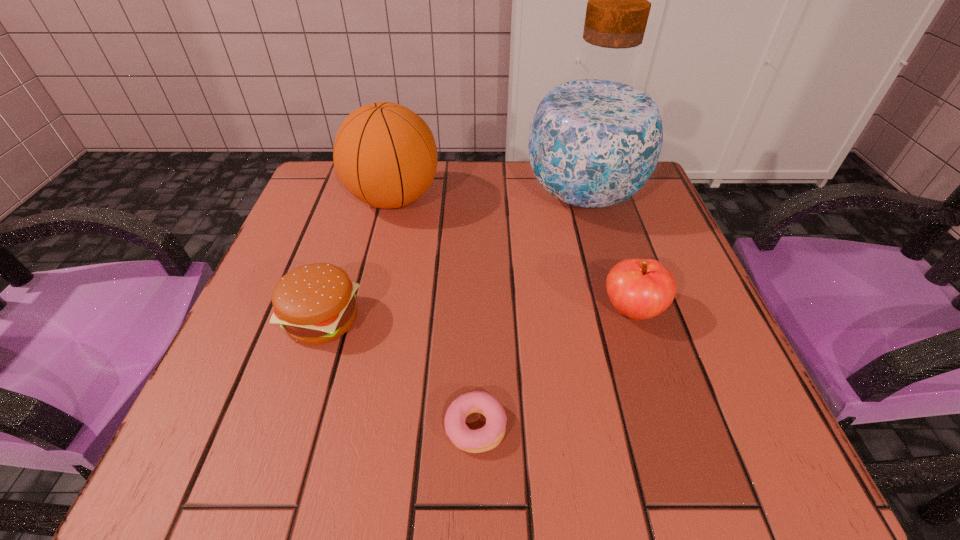
Find the location of a particular element. water jug is located at coordinates (596, 136).

This screenshot has height=540, width=960. In order to click on basketball in this screenshot , I will do `click(385, 155)`.

The width and height of the screenshot is (960, 540). I want to click on the third shortest object, so click(638, 288).

Where is `the fourth tallest object`? the fourth tallest object is located at coordinates (315, 303).

Where is `the shortest object`? This screenshot has width=960, height=540. the shortest object is located at coordinates (486, 438).

Identify the location of the nearest object. (486, 438).

You are a GUI agent. You are given a task and a screenshot of the screen. Output one action in this format:
    pyautogui.click(x=<x>, y=<y>)
    Task: Click on the vacant space located on the front of the water jug
    The width and height of the screenshot is (960, 540).
    Given the screenshot: What is the action you would take?
    pyautogui.click(x=624, y=339)

This screenshot has width=960, height=540. I want to click on free space located on the right of the basketball, so click(540, 199).

Locate an element on the screen. blank space located 0.200m on the front of the third shortest object is located at coordinates click(x=677, y=453).

Find the location of a particular element. Image resolution: width=960 pixels, height=540 pixels. free point located on the back of the hamburger is located at coordinates (338, 273).